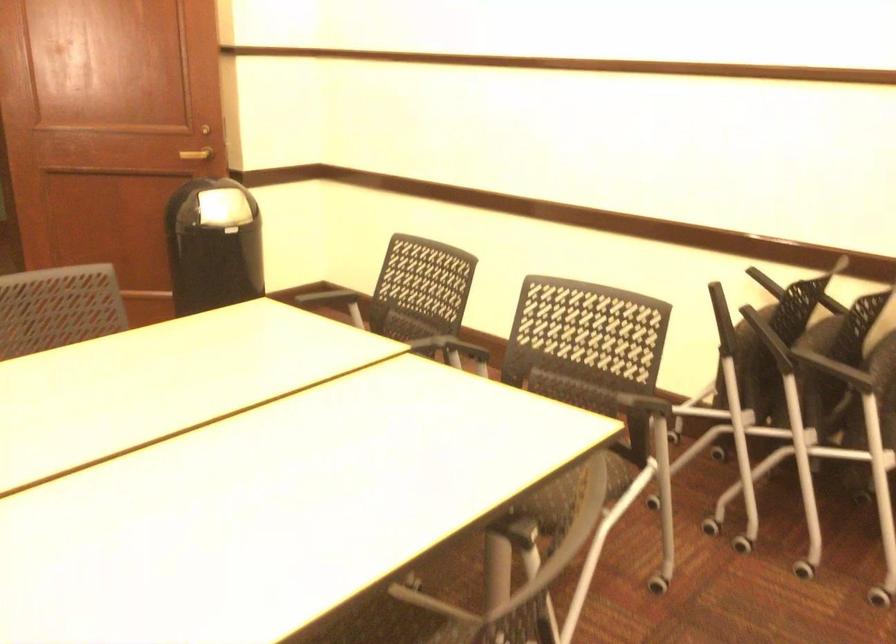
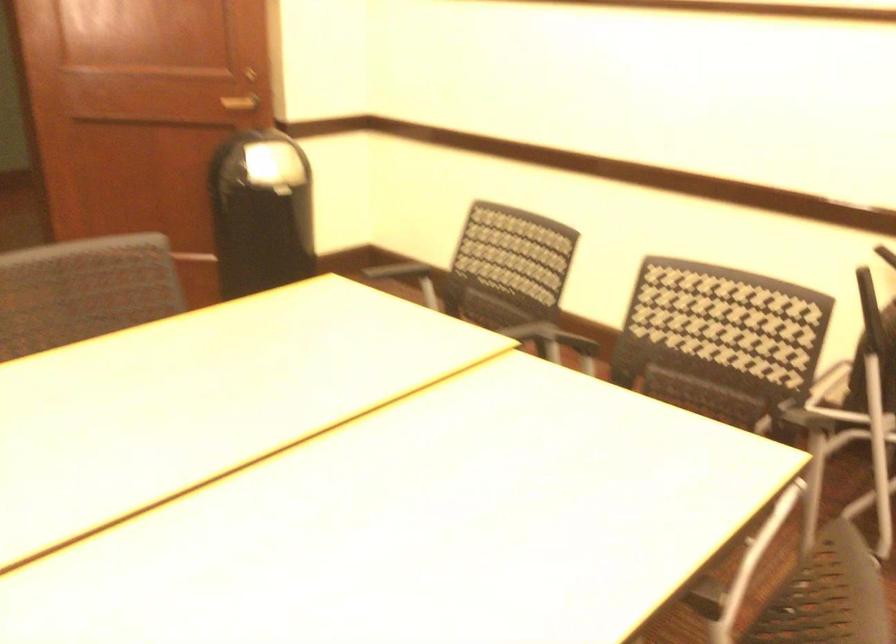
In the second image, find the point that corresponds to pixel 213 207 in the first image.

(274, 166)